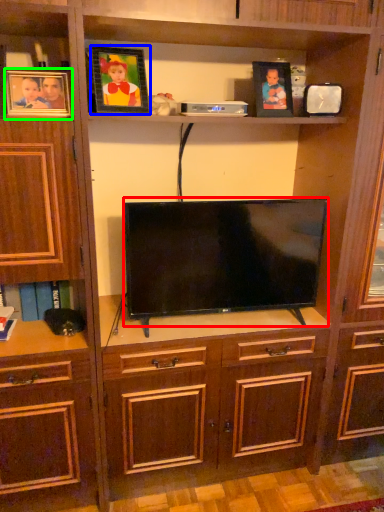
Question: Which is nearer to the television (highlighted by a red box)? picture frame (highlighted by a blue box) or picture frame (highlighted by a green box).

Choices:
 (A) picture frame
 (B) picture frame

Answer: (A)